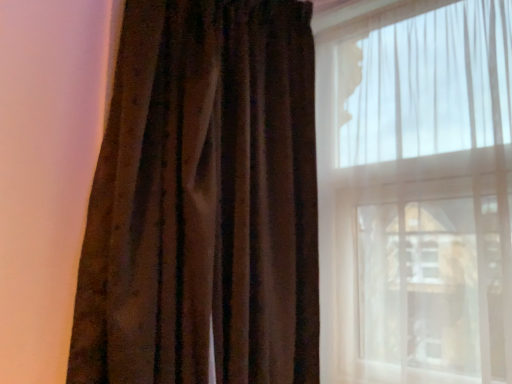
Question: Can you confirm if translucent white curtain at right is positioned to the right of velvet brown curtain at left?

Choices:
 (A) no
 (B) yes

Answer: (B)

Question: Is translucent white curtain at right further to camera compared to velvet brown curtain at left?

Choices:
 (A) no
 (B) yes

Answer: (B)

Question: From a real-world perspective, is translucent white curtain at right under velvet brown curtain at left?

Choices:
 (A) yes
 (B) no

Answer: (A)

Question: Considering the relative positions of translucent white curtain at right and velvet brown curtain at left in the image provided, is translucent white curtain at right to the left of velvet brown curtain at left from the viewer's perspective?

Choices:
 (A) yes
 (B) no

Answer: (B)

Question: Does translucent white curtain at right have a greater width compared to velvet brown curtain at left?

Choices:
 (A) yes
 (B) no

Answer: (B)

Question: Can you confirm if translucent white curtain at right is taller than velvet brown curtain at left?

Choices:
 (A) no
 (B) yes

Answer: (A)

Question: Can you confirm if velvet brown curtain at left is taller than translucent white curtain at right?

Choices:
 (A) no
 (B) yes

Answer: (B)

Question: From the image's perspective, is velvet brown curtain at left located beneath translucent white curtain at right?

Choices:
 (A) yes
 (B) no

Answer: (B)

Question: Does velvet brown curtain at left turn towards translucent white curtain at right?

Choices:
 (A) yes
 (B) no

Answer: (B)

Question: Can we say velvet brown curtain at left lies outside translucent white curtain at right?

Choices:
 (A) no
 (B) yes

Answer: (B)

Question: Considering the relative positions of velvet brown curtain at left and translucent white curtain at right in the image provided, is velvet brown curtain at left to the right of translucent white curtain at right from the viewer's perspective?

Choices:
 (A) no
 (B) yes

Answer: (A)

Question: Is translucent white curtain at right surrounded by velvet brown curtain at left?

Choices:
 (A) yes
 (B) no

Answer: (B)

Question: Is velvet brown curtain at left situated inside translucent white curtain at right or outside?

Choices:
 (A) inside
 (B) outside

Answer: (B)